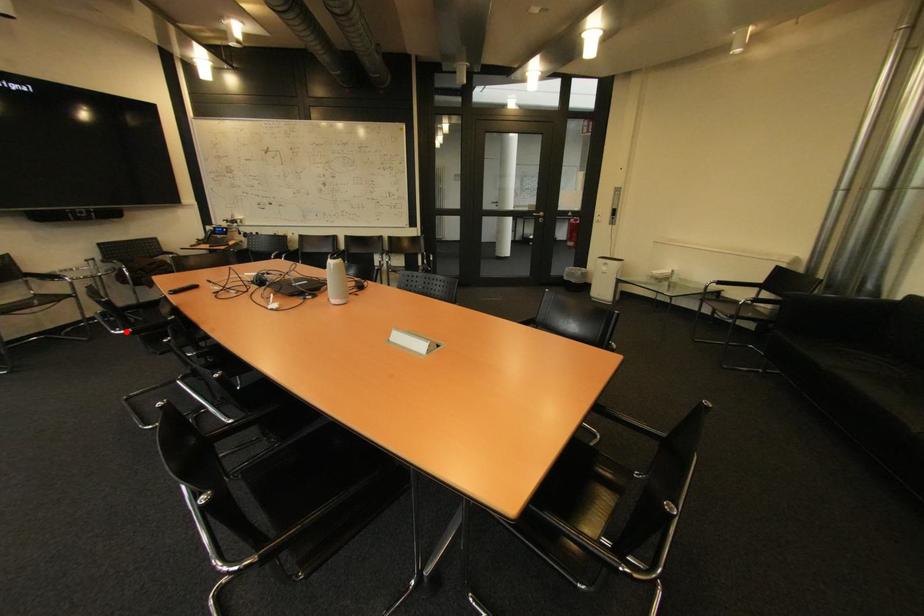
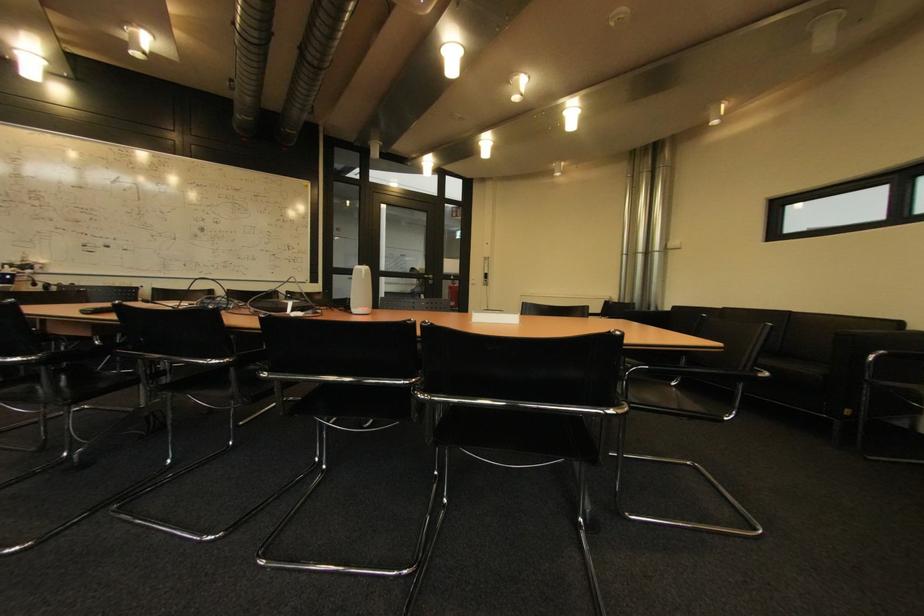
Question: I am providing you with two images of the same scene from different viewpoints. In image1, a red point is highlighted. Considering the same 3D point in image2, which of the following is correct?

Choices:
 (A) It is closer
 (B) It is farther

Answer: (A)